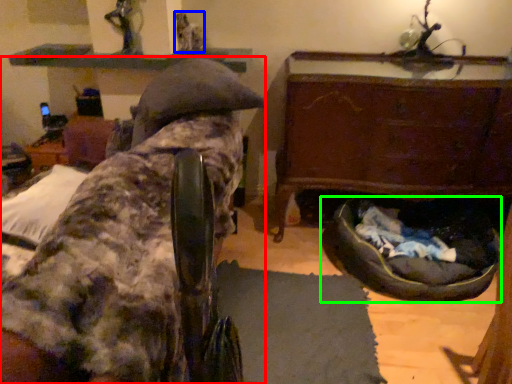
Question: Which object is positioned farthest from furniture (highlighted by a red box)? Select from person (highlighted by a blue box) and dog bed (highlighted by a green box).

Choices:
 (A) person
 (B) dog bed

Answer: (A)